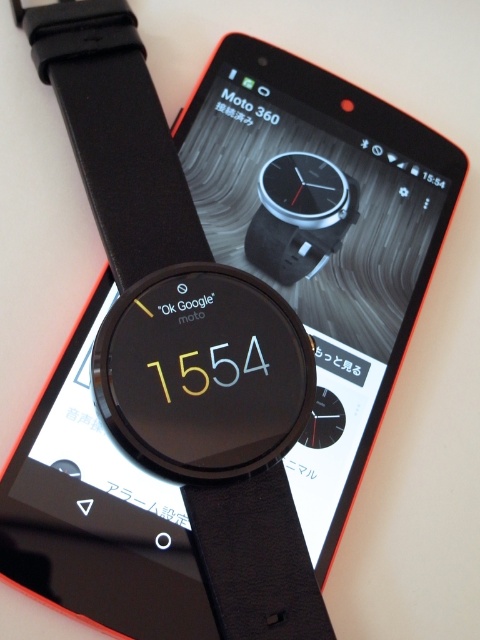
Between black leather strap at center and black matte watch at center, which one has less height?

Standing shorter between the two is black matte watch at center.

Does black leather strap at center have a greater height compared to black matte watch at center?

Yes.

What do you see at coordinates (118, 138) in the screenshot? I see `black leather strap at center` at bounding box center [118, 138].

I want to click on black leather strap at center, so click(x=118, y=138).